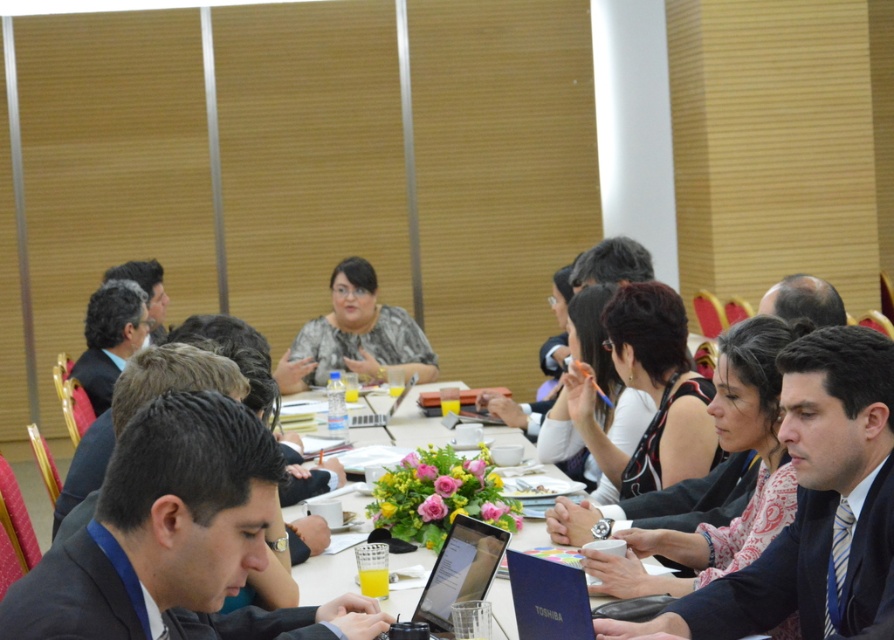
Does dark blue suit at center appear over blue matte laptop at lower center?

Correct, dark blue suit at center is located above blue matte laptop at lower center.

Does point (829, 582) come behind point (547, 577)?

Yes, it is behind point (547, 577).

This screenshot has width=894, height=640. I want to click on dark blue suit at center, so click(814, 506).

Measure the distance from dark blue suit at center to silver metallic laptop at center.

dark blue suit at center and silver metallic laptop at center are 53.85 centimeters apart from each other.

In the scene shown: Does dark blue suit at center have a larger size compared to silver metallic laptop at center?

Correct, dark blue suit at center is larger in size than silver metallic laptop at center.

Where is `dark blue suit at center`? This screenshot has width=894, height=640. dark blue suit at center is located at coordinates (814, 506).

Is point (454, 598) farther from camera compared to point (524, 620)?

Yes, it is behind point (524, 620).

Between point (432, 625) and point (546, 580), which one is positioned behind?

The point (432, 625) is behind.

The width and height of the screenshot is (894, 640). In order to click on silver metallic laptop at center in this screenshot , I will do `click(460, 572)`.